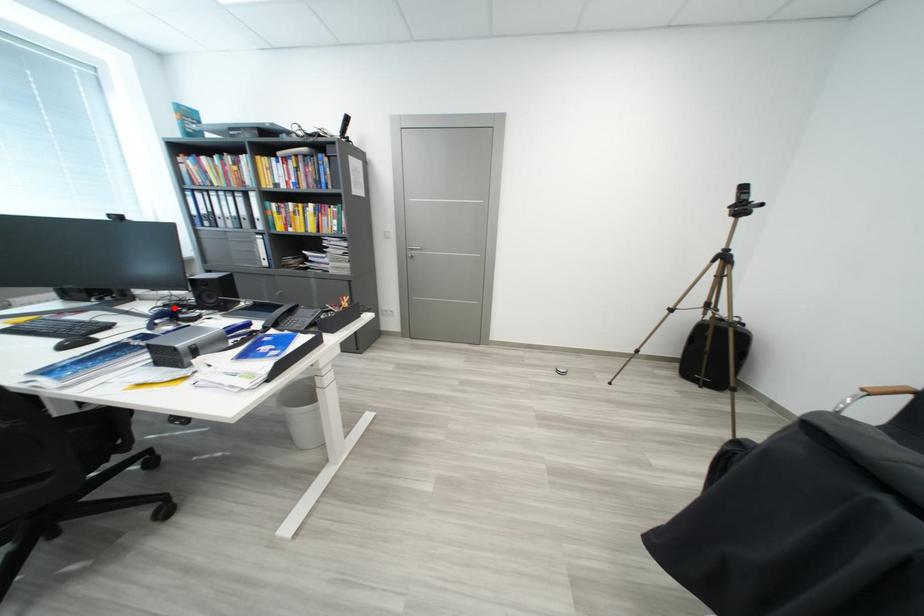
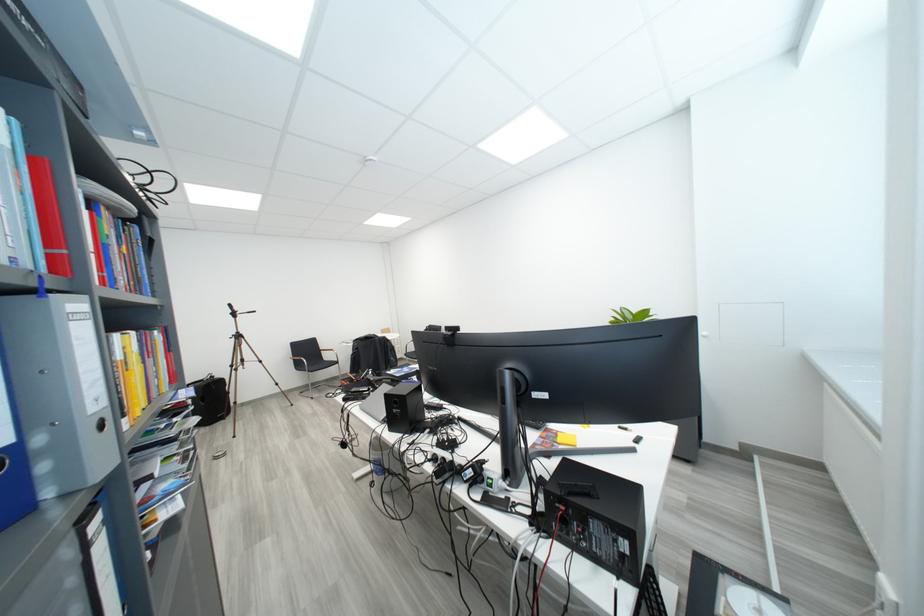
Question: I am providing you with two images of the same scene from different viewpoints. A red point is marked on the first image. At the location where the point appears in image 1, is it still visible in image 2?

Choices:
 (A) Yes
 (B) No

Answer: (B)